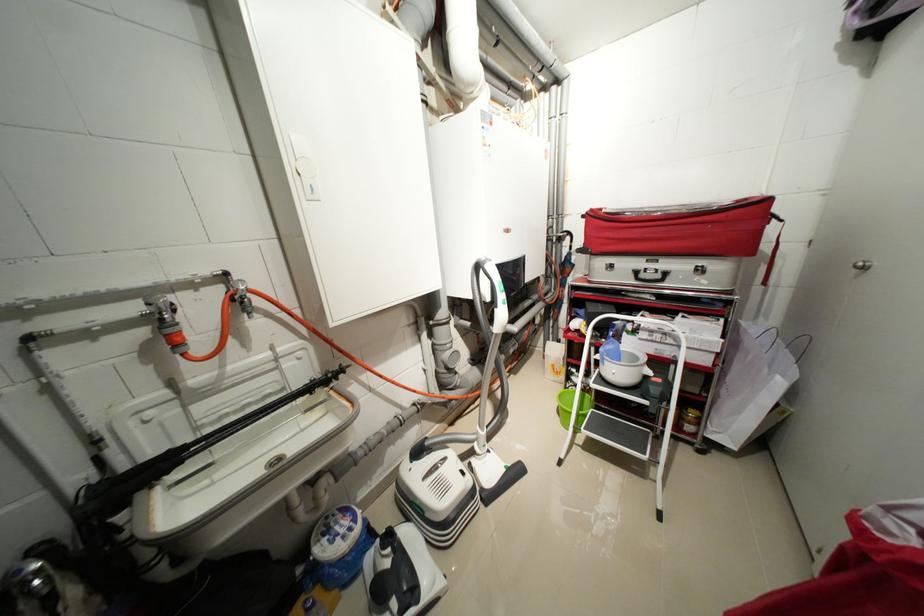
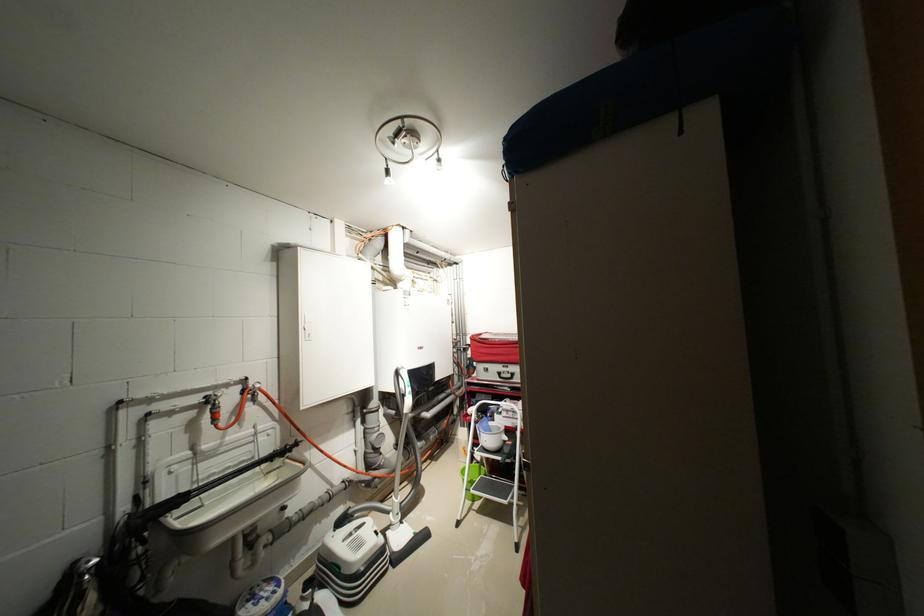
The point at (516,469) is marked in the first image. Where is the corresponding point in the second image?

(423, 536)